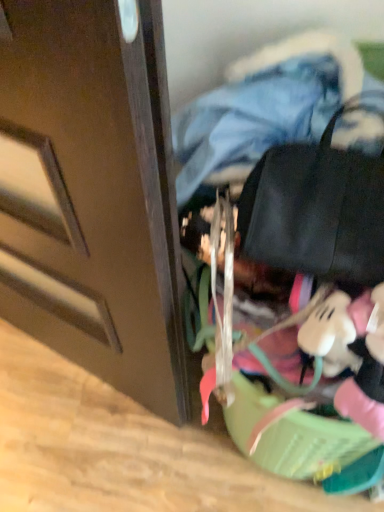
Where is `black leather messenger bag at upper right`? This screenshot has height=512, width=384. black leather messenger bag at upper right is located at coordinates (318, 207).

What do you see at coordinates (318, 207) in the screenshot? The width and height of the screenshot is (384, 512). I see `black leather messenger bag at upper right` at bounding box center [318, 207].

Measure the distance between black leather messenger bag at upper right and camera.

The distance of black leather messenger bag at upper right from camera is 20.07 inches.

What is the approximate height of black leather messenger bag at upper right?

black leather messenger bag at upper right is 5.02 inches in height.

Locate an element on the screen. The height and width of the screenshot is (512, 384). denim jacket at upper center is located at coordinates (265, 106).

Describe the element at coordinates (265, 106) in the screenshot. I see `denim jacket at upper center` at that location.

What is the approximate height of denim jacket at upper center?

denim jacket at upper center is 24.32 centimeters tall.

Measure the distance between point (x=325, y=59) and camera.

Point (x=325, y=59) and camera are 57.60 centimeters apart.

At what (x,y) coordinates should I click in order to perform the action: click on black leather messenger bag at upper right. Please return your answer as a coordinate pair (x, y). Looking at the image, I should click on (318, 207).

Can you confirm if denim jacket at upper center is positioned to the right of black leather messenger bag at upper right?

No.

Which object is further away from the camera taking this photo, denim jacket at upper center or black leather messenger bag at upper right?

denim jacket at upper center is further away from the camera.

Is point (241, 103) closer or farther from the camera than point (265, 227)?

Point (241, 103) is positioned farther from the camera compared to point (265, 227).

From the image's perspective, which one is positioned lower, denim jacket at upper center or black leather messenger bag at upper right?

black leather messenger bag at upper right is shown below in the image.

From a real-world perspective, is denim jacket at upper center physically below black leather messenger bag at upper right?

No, from a real-world perspective, denim jacket at upper center is not beneath black leather messenger bag at upper right.

Based on the photo, considering the sizes of objects denim jacket at upper center and black leather messenger bag at upper right in the image provided, who is wider, denim jacket at upper center or black leather messenger bag at upper right?

Wider between the two is denim jacket at upper center.

From their relative heights in the image, would you say denim jacket at upper center is taller or shorter than black leather messenger bag at upper right?

Considering their sizes, denim jacket at upper center has more height than black leather messenger bag at upper right.

Looking at this image, between denim jacket at upper center and black leather messenger bag at upper right, which one has smaller size?

black leather messenger bag at upper right is smaller.

Is denim jacket at upper center positioned beyond the bounds of black leather messenger bag at upper right?

Yes, denim jacket at upper center is outside of black leather messenger bag at upper right.

In the scene shown: Is denim jacket at upper center positioned far away from black leather messenger bag at upper right?

denim jacket at upper center is near black leather messenger bag at upper right, not far away.

Does denim jacket at upper center turn towards black leather messenger bag at upper right?

Yes, denim jacket at upper center is oriented towards black leather messenger bag at upper right.

What's the angular difference between denim jacket at upper center and black leather messenger bag at upper right's facing directions?

The angular difference between denim jacket at upper center and black leather messenger bag at upper right is 0.000161 degrees.

At what (x,y) coordinates should I click in order to perform the action: click on clothing that is on the left side of black leather messenger bag at upper right. Please return your answer as a coordinate pair (x, y). The width and height of the screenshot is (384, 512). Looking at the image, I should click on (265, 106).

Between black leather messenger bag at upper right and denim jacket at upper center, which one appears on the left side from the viewer's perspective?

denim jacket at upper center.

Is black leather messenger bag at upper right in front of or behind denim jacket at upper center in the image?

Visually, black leather messenger bag at upper right is located in front of denim jacket at upper center.

Does point (346, 156) come behind point (195, 151)?

That is False.

From the image's perspective, who appears lower, black leather messenger bag at upper right or denim jacket at upper center?

black leather messenger bag at upper right is shown below in the image.

From a real-world perspective, relative to denim jacket at upper center, is black leather messenger bag at upper right vertically above or below?

In terms of real-world spatial position, black leather messenger bag at upper right is below denim jacket at upper center.

Is black leather messenger bag at upper right wider or thinner than denim jacket at upper center?

black leather messenger bag at upper right is thinner than denim jacket at upper center.

Is black leather messenger bag at upper right shorter than denim jacket at upper center?

Correct, black leather messenger bag at upper right is not as tall as denim jacket at upper center.

Consider the image. Looking at the image, does black leather messenger bag at upper right seem bigger or smaller compared to denim jacket at upper center?

Considering their sizes, black leather messenger bag at upper right takes up less space than denim jacket at upper center.

Is black leather messenger bag at upper right spatially inside denim jacket at upper center, or outside of it?

black leather messenger bag at upper right can be found inside denim jacket at upper center.

Is there a large distance between black leather messenger bag at upper right and denim jacket at upper center?

No, black leather messenger bag at upper right is not far from denim jacket at upper center.

Is black leather messenger bag at upper right facing towards denim jacket at upper center?

No, black leather messenger bag at upper right does not turn towards denim jacket at upper center.

Where is `clothing above the black leather messenger bag at upper right (from a real-world perspective)`? The height and width of the screenshot is (512, 384). clothing above the black leather messenger bag at upper right (from a real-world perspective) is located at coordinates (265, 106).

Where is `messenger bag below the denim jacket at upper center (from the image's perspective)`? The height and width of the screenshot is (512, 384). messenger bag below the denim jacket at upper center (from the image's perspective) is located at coordinates (318, 207).

This screenshot has width=384, height=512. What are the coordinates of `messenger bag to the right of denim jacket at upper center` in the screenshot? It's located at (318, 207).